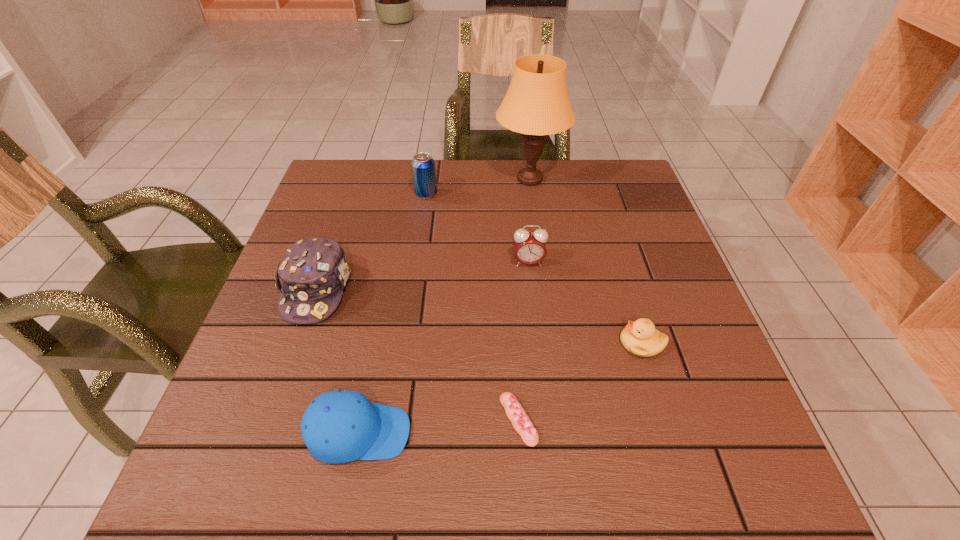
At what (x,y) coordinates should I click in order to perform the action: click on the tallest object. Please return your answer as a coordinate pair (x, y). The height and width of the screenshot is (540, 960). Looking at the image, I should click on pyautogui.click(x=537, y=104).

The image size is (960, 540). I want to click on beer can, so click(423, 165).

At what (x,y) coordinates should I click in order to perform the action: click on alarm clock. Please return your answer as a coordinate pair (x, y). Image resolution: width=960 pixels, height=540 pixels. Looking at the image, I should click on (529, 246).

At what (x,y) coordinates should I click in order to perform the action: click on the farther cap. Please return your answer as a coordinate pair (x, y). The width and height of the screenshot is (960, 540). Looking at the image, I should click on (313, 272).

Where is `the third shortest object`? This screenshot has width=960, height=540. the third shortest object is located at coordinates (340, 426).

In order to click on the nearer cap in this screenshot , I will do `click(340, 426)`.

Find the location of a particular element. This screenshot has height=540, width=960. the second shortest object is located at coordinates (640, 338).

At what (x,y) coordinates should I click in order to perform the action: click on duckling. Please return your answer as a coordinate pair (x, y). This screenshot has height=540, width=960. Looking at the image, I should click on (640, 338).

Locate an element on the screen. the shortest object is located at coordinates [516, 414].

Locate an element on the screen. This screenshot has width=960, height=540. vacant space situated on the left of the tallest object is located at coordinates (432, 179).